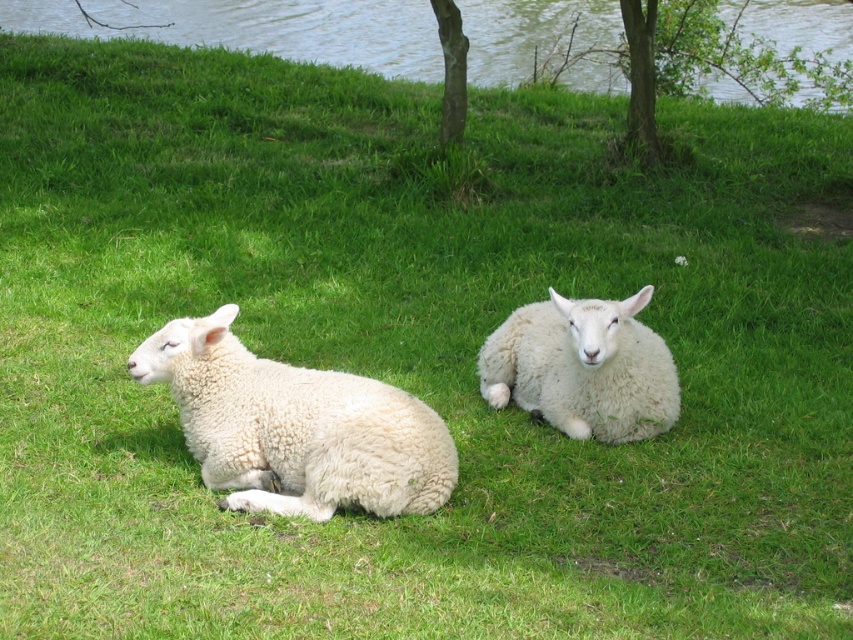
Question: Is white fluffy sheep at right wider than green leafy tree at upper center?

Choices:
 (A) yes
 (B) no

Answer: (A)

Question: Which object appears closest to the camera in this image?

Choices:
 (A) white fluffy sheep at left
 (B) green textured tree at upper center
 (C) clear water at upper center

Answer: (A)

Question: Which object is the closest to the clear water at upper center?

Choices:
 (A) white fluffy sheep at right
 (B) green textured tree at upper center
 (C) green leafy tree at upper center

Answer: (C)

Question: Which point is farther from the camera taking this photo?

Choices:
 (A) (741, 64)
 (B) (277, 499)
 (C) (450, 100)

Answer: (A)

Question: From the image, what is the correct spatial relationship of clear water at upper center in relation to white fluffy sheep at right?

Choices:
 (A) left
 (B) right

Answer: (A)

Question: Is clear water at upper center to the left of green textured tree at upper center from the viewer's perspective?

Choices:
 (A) yes
 (B) no

Answer: (A)